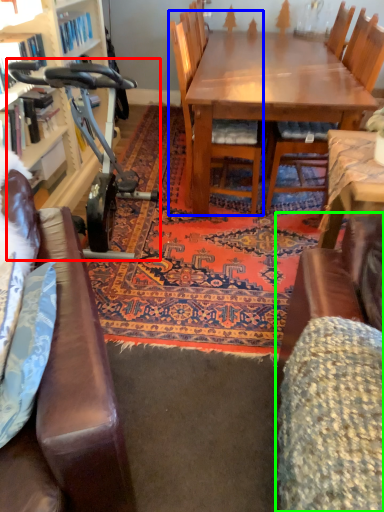
Question: Which object is the farthest from sport equipment (highlighted by a red box)? Choose among these: chair (highlighted by a blue box) or swivel chair (highlighted by a green box).

Choices:
 (A) chair
 (B) swivel chair

Answer: (B)